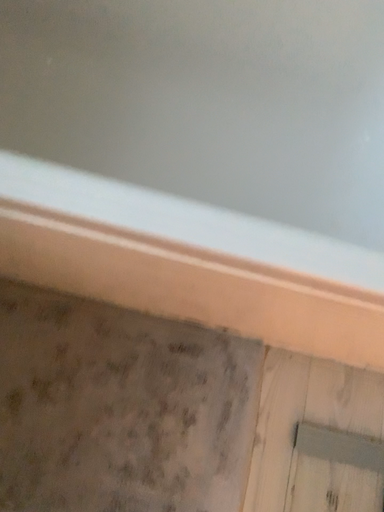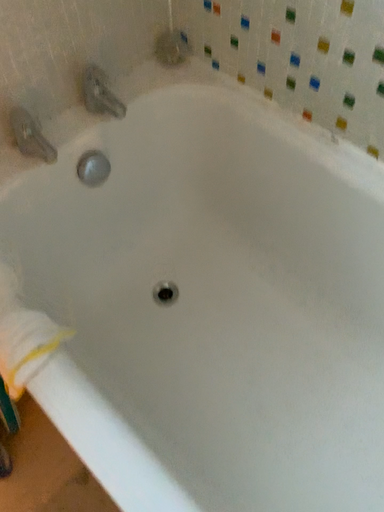
Question: How did the camera likely rotate when shooting the video?

Choices:
 (A) rotated upward
 (B) rotated downward

Answer: (A)